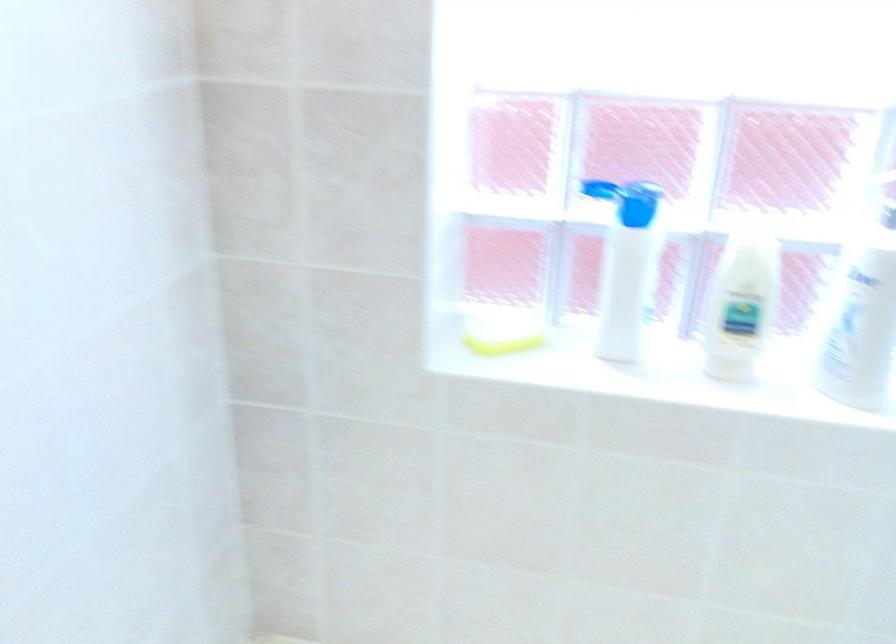
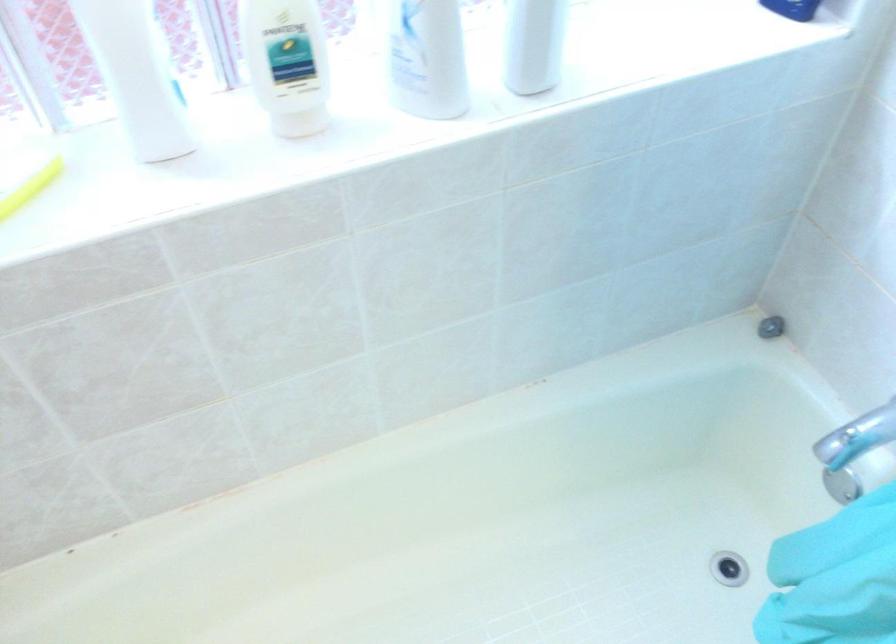
The first image is from the beginning of the video and the second image is from the end. How did the camera likely rotate when shooting the video?

The camera's rotation is toward right-down.